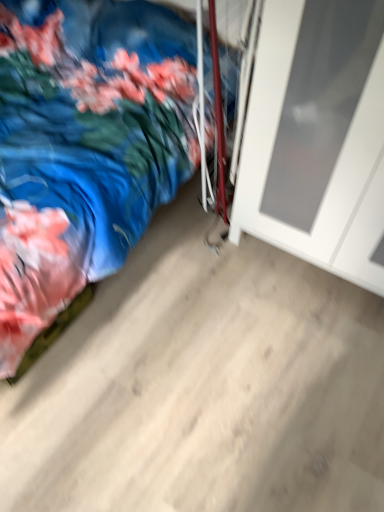
This screenshot has height=512, width=384. Find the location of `vacant space that is to the left of white matte door at right`. vacant space that is to the left of white matte door at right is located at coordinates (203, 284).